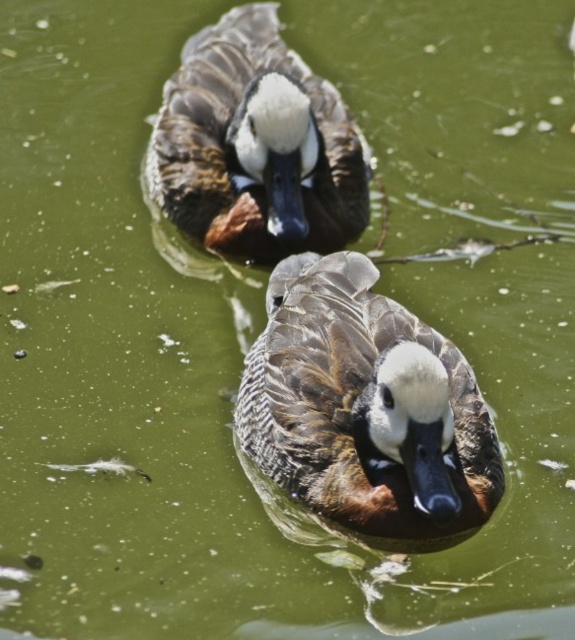
Question: Which point is farther to the camera?

Choices:
 (A) brown speckled duck at center
 (B) brown speckled duck at upper center

Answer: (B)

Question: Considering the relative positions of brown speckled duck at center and brown speckled duck at upper center in the image provided, where is brown speckled duck at center located with respect to brown speckled duck at upper center?

Choices:
 (A) right
 (B) left

Answer: (A)

Question: Can you confirm if brown speckled duck at center is positioned to the left of brown speckled duck at upper center?

Choices:
 (A) no
 (B) yes

Answer: (A)

Question: Is brown speckled duck at center wider than brown speckled duck at upper center?

Choices:
 (A) yes
 (B) no

Answer: (B)

Question: Which point is closer to the camera?

Choices:
 (A) (262, 106)
 (B) (281, 262)

Answer: (B)